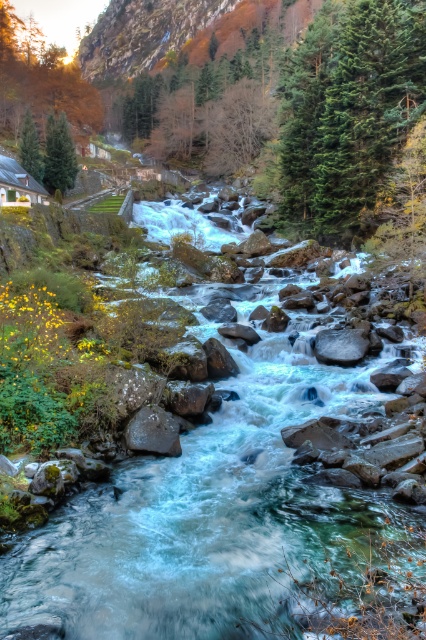
Question: Which object appears closest to the camera in this image?

Choices:
 (A) smooth gray rock at center
 (B) clear water at center

Answer: (B)

Question: Can you confirm if clear water at center is positioned below smooth gray rock at center?

Choices:
 (A) no
 (B) yes

Answer: (A)

Question: Is clear water at center thinner than smooth gray rock at center?

Choices:
 (A) yes
 (B) no

Answer: (B)

Question: Which point is farther from the camera taking this photo?

Choices:
 (A) click(x=154, y=416)
 (B) click(x=60, y=358)

Answer: (B)

Question: Can you confirm if clear water at center is positioned above smooth gray rock at center?

Choices:
 (A) no
 (B) yes

Answer: (B)

Question: Which of the following is the closest to the observer?

Choices:
 (A) (155, 426)
 (B) (34, 465)

Answer: (B)